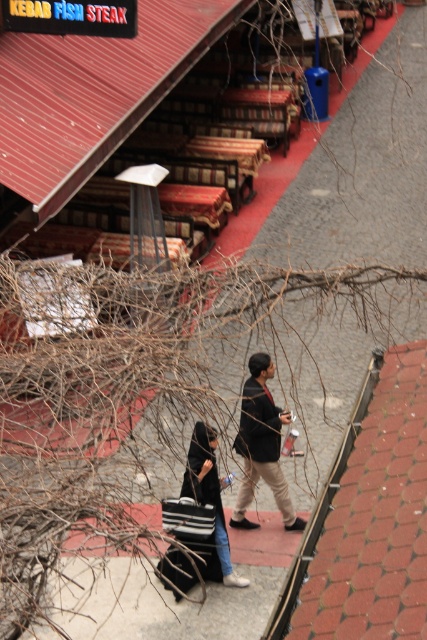
Does dark brown leather jacket at center appear on the left side of black fabric bag at center?

No, dark brown leather jacket at center is not to the left of black fabric bag at center.

Does dark brown leather jacket at center come behind black fabric bag at center?

Yes, dark brown leather jacket at center is behind black fabric bag at center.

Is point (260, 465) farther from viewer compared to point (207, 460)?

Yes, it is.

At what (x,y) coordinates should I click in order to perform the action: click on dark brown leather jacket at center. Please return your answer as a coordinate pair (x, y). The width and height of the screenshot is (427, 640). Looking at the image, I should click on (262, 445).

Between black fabric bag at center and striped fabric shopping bag at lower center, which one is positioned higher?

black fabric bag at center

Between black fabric bag at center and striped fabric shopping bag at lower center, which one has more height?

black fabric bag at center is taller.

Identify the location of black fabric bag at center. The width and height of the screenshot is (427, 640). (210, 493).

Is point (272, 374) positioned before point (187, 522)?

That is False.

Looking at this image, is dark brown leather jacket at center to the right of striped fabric shopping bag at lower center from the viewer's perspective?

Yes, dark brown leather jacket at center is to the right of striped fabric shopping bag at lower center.

The width and height of the screenshot is (427, 640). What do you see at coordinates (262, 445) in the screenshot?
I see `dark brown leather jacket at center` at bounding box center [262, 445].

Locate an element on the screen. The image size is (427, 640). dark brown leather jacket at center is located at coordinates (262, 445).